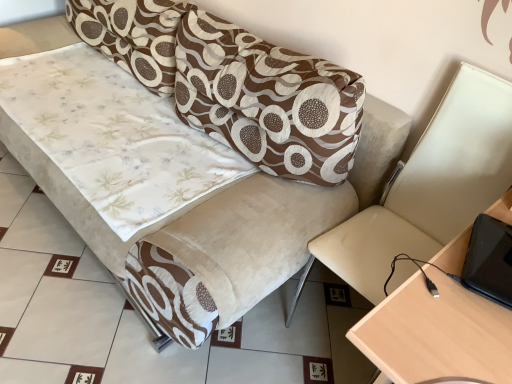
Question: Is beige leather swivel chair at right to the right of brown textured pillow at upper center from the viewer's perspective?

Choices:
 (A) no
 (B) yes

Answer: (B)

Question: Is brown textured pillow at upper center completely or partially inside beige leather swivel chair at right?

Choices:
 (A) no
 (B) yes

Answer: (A)

Question: Is beige leather swivel chair at right beside brown textured pillow at upper center?

Choices:
 (A) yes
 (B) no

Answer: (B)

Question: From the image's perspective, does beige leather swivel chair at right appear higher than brown textured pillow at upper center?

Choices:
 (A) no
 (B) yes

Answer: (A)

Question: Can we say beige leather swivel chair at right lies outside brown textured pillow at upper center?

Choices:
 (A) no
 (B) yes

Answer: (B)

Question: Relative to beige leather swivel chair at right, is velvet-like beige couch at center in front or behind?

Choices:
 (A) behind
 (B) front

Answer: (A)

Question: From the image's perspective, is velvet-like beige couch at center above or below beige leather swivel chair at right?

Choices:
 (A) below
 (B) above

Answer: (B)

Question: Is velvet-like beige couch at center situated inside beige leather swivel chair at right or outside?

Choices:
 (A) outside
 (B) inside

Answer: (A)

Question: From a real-world perspective, is velvet-like beige couch at center positioned above or below beige leather swivel chair at right?

Choices:
 (A) above
 (B) below

Answer: (B)

Question: In terms of size, does beige leather swivel chair at right appear bigger or smaller than brown textured pillow at upper center?

Choices:
 (A) small
 (B) big

Answer: (B)

Question: In terms of width, does beige leather swivel chair at right look wider or thinner when compared to brown textured pillow at upper center?

Choices:
 (A) thin
 (B) wide

Answer: (B)

Question: Considering the positions of point (423, 258) and point (271, 59), is point (423, 258) closer or farther from the camera than point (271, 59)?

Choices:
 (A) farther
 (B) closer

Answer: (B)

Question: From a real-world perspective, relative to brown textured pillow at upper center, is beige leather swivel chair at right vertically above or below?

Choices:
 (A) below
 (B) above

Answer: (A)

Question: From a real-world perspective, relative to beige leather swivel chair at right, is brown textured pillow at upper center vertically above or below?

Choices:
 (A) above
 (B) below

Answer: (A)

Question: From the image's perspective, relative to beige leather swivel chair at right, is brown textured pillow at upper center above or below?

Choices:
 (A) below
 (B) above

Answer: (B)